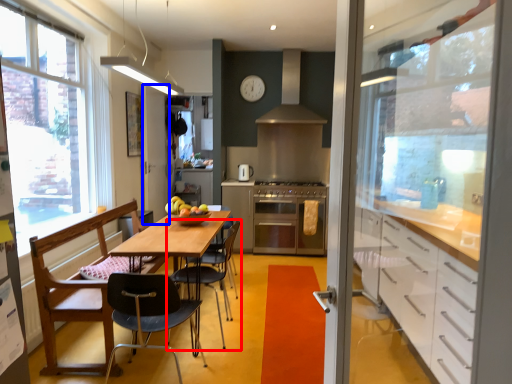
Question: Which object appears closest to the camera in this image, chair (highlighted by a red box) or screen door (highlighted by a blue box)?

Choices:
 (A) chair
 (B) screen door

Answer: (A)